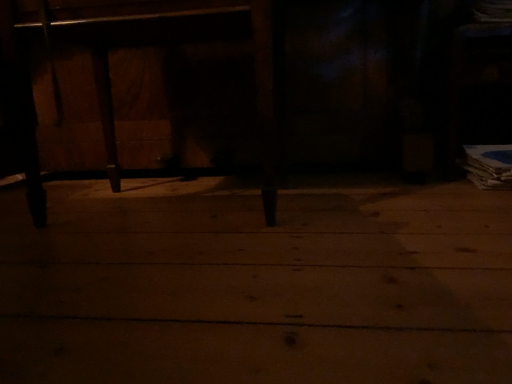
Question: Are wooden table at center and wooden floor at center located far from each other?

Choices:
 (A) yes
 (B) no

Answer: (B)

Question: Is the position of wooden table at center more distant than that of wooden floor at center?

Choices:
 (A) yes
 (B) no

Answer: (A)

Question: From a real-world perspective, is wooden table at center on wooden floor at center?

Choices:
 (A) no
 (B) yes

Answer: (B)

Question: Does wooden table at center have a greater width compared to wooden floor at center?

Choices:
 (A) no
 (B) yes

Answer: (A)

Question: Is wooden table at center oriented towards wooden floor at center?

Choices:
 (A) no
 (B) yes

Answer: (B)

Question: Can you confirm if wooden table at center is thinner than wooden floor at center?

Choices:
 (A) yes
 (B) no

Answer: (A)

Question: From a real-world perspective, is wooden floor at center located higher than wooden table at center?

Choices:
 (A) yes
 (B) no

Answer: (B)

Question: Is wooden floor at center at the right side of wooden table at center?

Choices:
 (A) no
 (B) yes

Answer: (B)

Question: Is wooden floor at center further to camera compared to wooden table at center?

Choices:
 (A) yes
 (B) no

Answer: (B)

Question: Can you confirm if wooden floor at center is bigger than wooden table at center?

Choices:
 (A) yes
 (B) no

Answer: (B)

Question: From the image's perspective, is wooden floor at center located above wooden table at center?

Choices:
 (A) no
 (B) yes

Answer: (A)

Question: Considering the relative sizes of wooden floor at center and wooden table at center in the image provided, is wooden floor at center thinner than wooden table at center?

Choices:
 (A) no
 (B) yes

Answer: (A)

Question: Considering their positions, is wooden table at center located in front of or behind wooden floor at center?

Choices:
 (A) front
 (B) behind

Answer: (B)